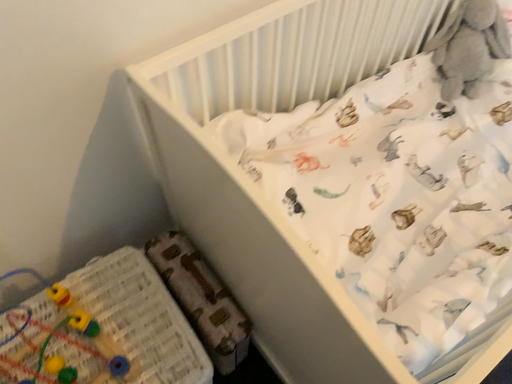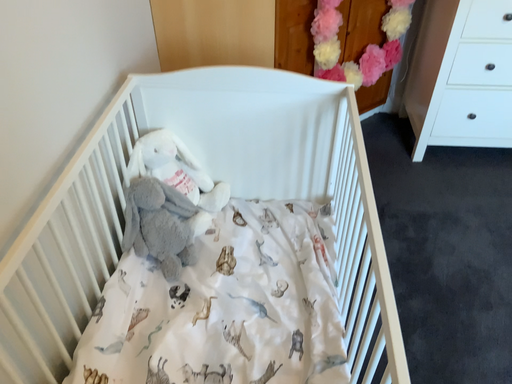
Question: How did the camera likely rotate when shooting the video?

Choices:
 (A) rotated upward
 (B) rotated downward

Answer: (A)